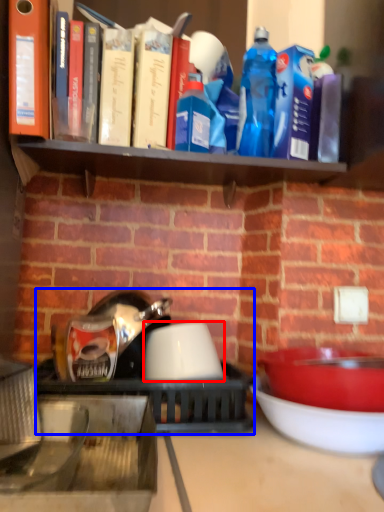
Question: Which point is further to the camera, bowl (highlighted by a red box) or appliance (highlighted by a blue box)?

Choices:
 (A) bowl
 (B) appliance

Answer: (A)